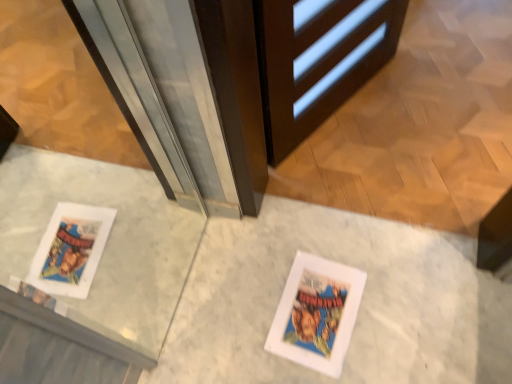
Locate an element on the screen. This screenshot has height=384, width=512. vacant area on top of matte white comic book at center (from a real-world perspective) is located at coordinates (315, 308).